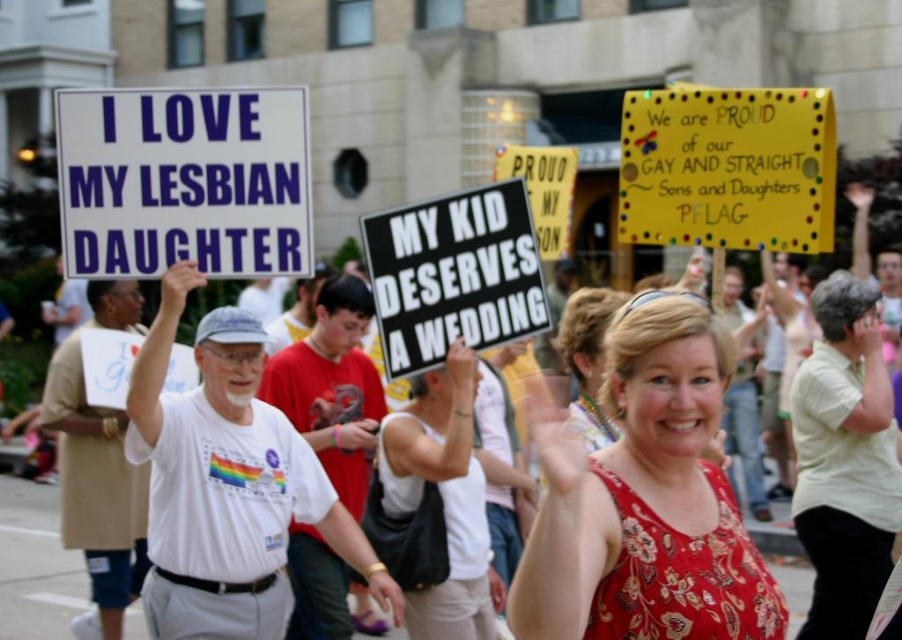
You are a photographer trying to capture a clear shot of both the white paper sign at upper left and the white tank top at center. Given their sizes, which object might be more challenging to focus on and why?

The white paper sign at upper left is smaller in size compared to the white tank top at center, making it more challenging to focus on due to its smaller size.